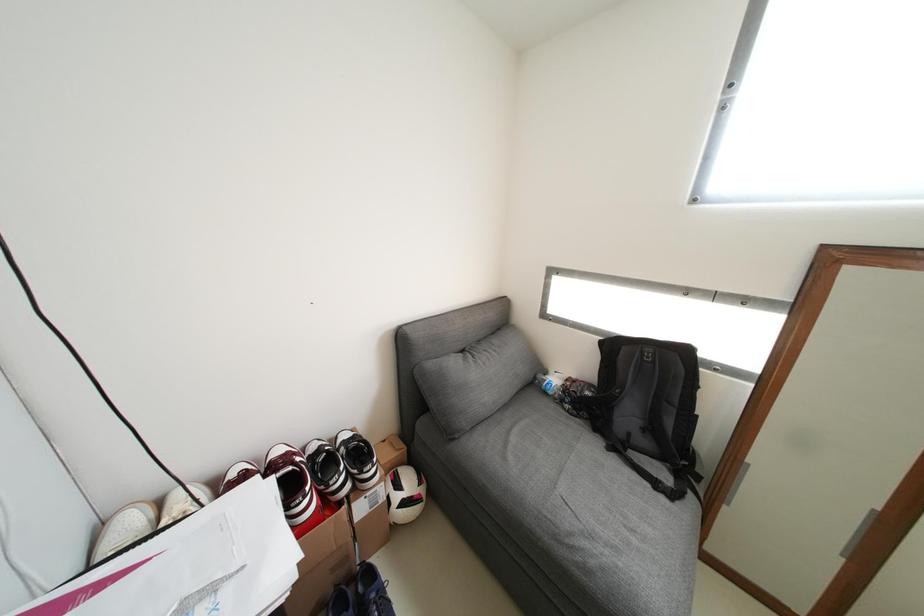
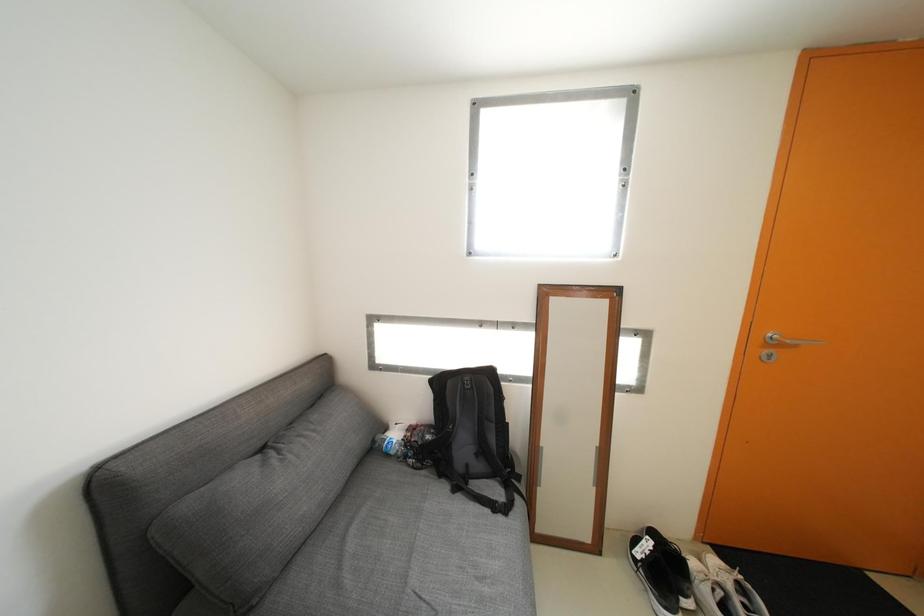
Question: The images are taken continuously from a first-person perspective. In which direction is your viewpoint rotating?

Choices:
 (A) Left
 (B) Right
 (C) Up
 (D) Down

Answer: (B)